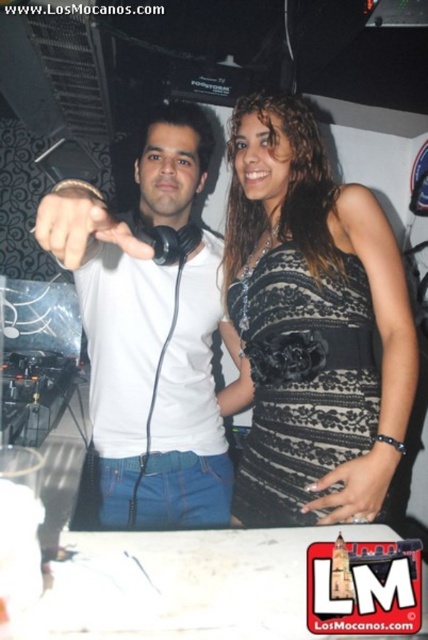
Describe the element at coordinates (312, 324) in the screenshot. The height and width of the screenshot is (640, 428). I see `black lace dress at center` at that location.

Which of these two, black lace dress at center or white matte t-shirt at center, stands shorter?

Standing shorter between the two is black lace dress at center.

This screenshot has width=428, height=640. What do you see at coordinates (312, 324) in the screenshot?
I see `black lace dress at center` at bounding box center [312, 324].

Find the location of a particular element. black lace dress at center is located at coordinates (x=312, y=324).